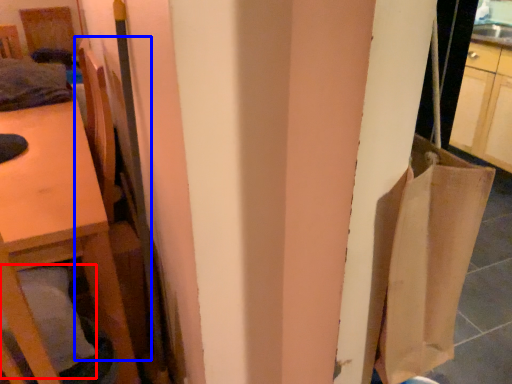
Question: Which of the following is the closest to the observer, pillow (highlighted by a red box) or chair (highlighted by a blue box)?

Choices:
 (A) pillow
 (B) chair

Answer: (A)